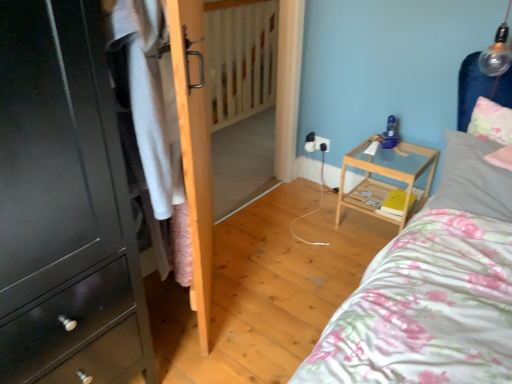
Locate an element on the screen. The width and height of the screenshot is (512, 384). vacant space situated on the left part of light wood/transparent glass nightstand at center-right is located at coordinates (318, 224).